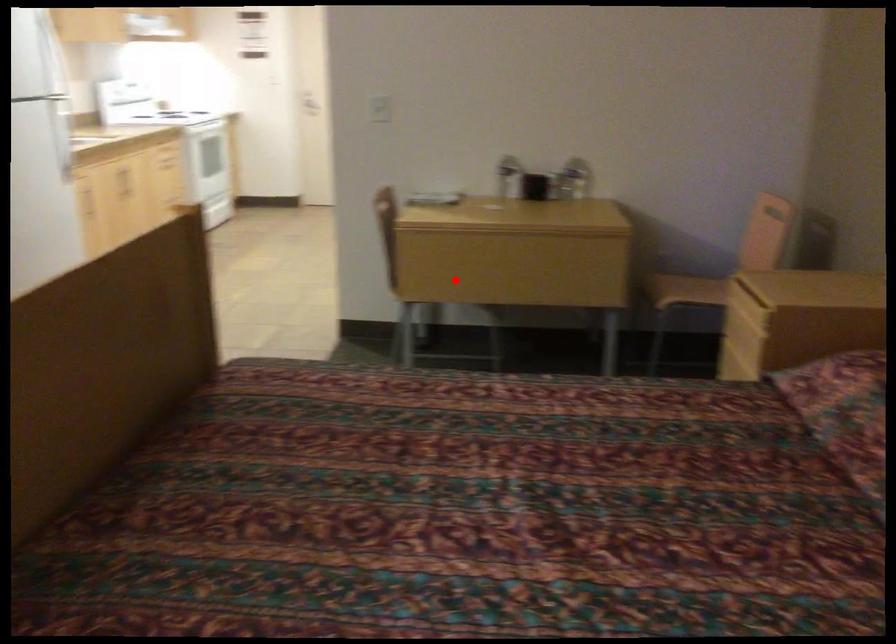
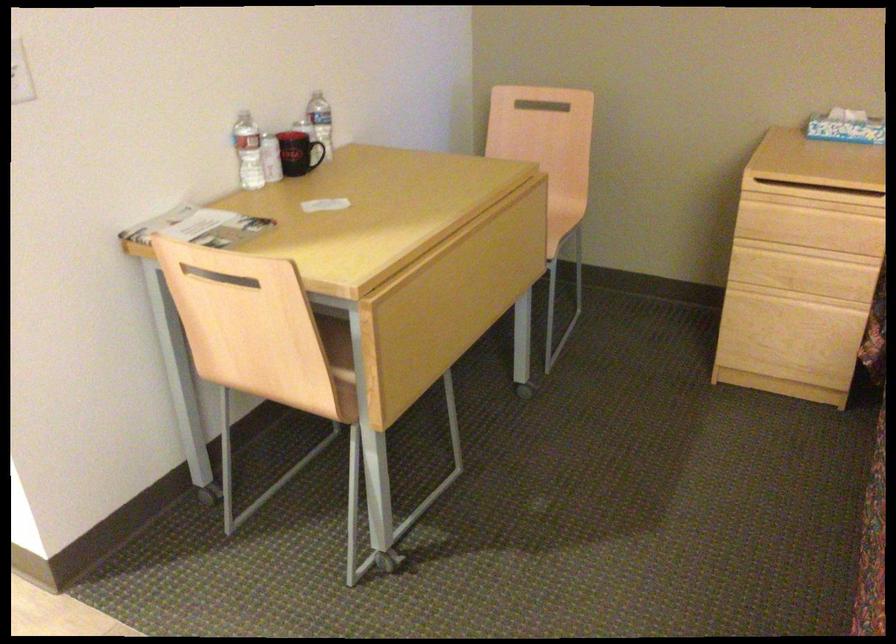
Question: I am providing you with two images of the same scene from different viewpoints. Image1 has a red point marked. In image2, the corresponding 3D location appears at what relative position? Reply with the corresponding letter.

Choices:
 (A) Closer
 (B) Farther

Answer: (A)